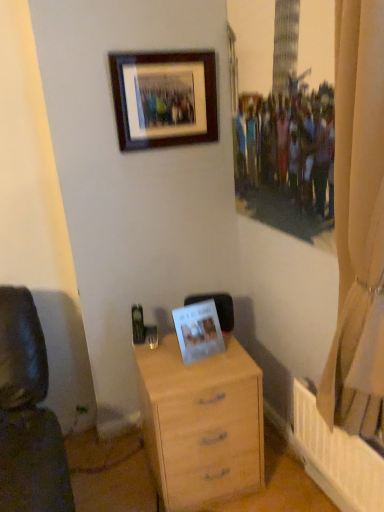
Question: Is light wood chest of drawers at center thinner than wooden frame at upper center, the first picture frame when ordered from top to bottom?

Choices:
 (A) yes
 (B) no

Answer: (B)

Question: From the image's perspective, is light wood chest of drawers at center on top of wooden frame at upper center, arranged as the second picture frame when ordered from the bottom?

Choices:
 (A) no
 (B) yes

Answer: (A)

Question: Is light wood chest of drawers at center oriented away from wooden frame at upper center, arranged as the second picture frame when ordered from the bottom?

Choices:
 (A) yes
 (B) no

Answer: (B)

Question: Is light wood chest of drawers at center next to wooden frame at upper center, the first picture frame when ordered from top to bottom?

Choices:
 (A) yes
 (B) no

Answer: (B)

Question: Is the position of light wood chest of drawers at center less distant than that of wooden frame at upper center, the first picture frame when ordered from top to bottom?

Choices:
 (A) no
 (B) yes

Answer: (B)

Question: Choose the correct answer: Is light wood chest of drawers at center inside white paper photo frame at center, acting as the 1th picture frame starting from the bottom, or outside it?

Choices:
 (A) inside
 (B) outside

Answer: (B)

Question: From a real-world perspective, is light wood chest of drawers at center positioned above or below white paper photo frame at center, acting as the 1th picture frame starting from the bottom?

Choices:
 (A) below
 (B) above

Answer: (A)

Question: From the image's perspective, relative to white paper photo frame at center, marked as the second picture frame in a top-to-bottom arrangement, is light wood chest of drawers at center above or below?

Choices:
 (A) above
 (B) below

Answer: (B)

Question: Considering the positions of light wood chest of drawers at center and white paper photo frame at center, acting as the 1th picture frame starting from the bottom, in the image, is light wood chest of drawers at center wider or thinner than white paper photo frame at center, acting as the 1th picture frame starting from the bottom,?

Choices:
 (A) wide
 (B) thin

Answer: (A)

Question: Is wooden frame at upper center, the first picture frame when ordered from top to bottom, in front of or behind beige fabric curtain at right in the image?

Choices:
 (A) front
 (B) behind

Answer: (B)

Question: From a real-world perspective, relative to beige fabric curtain at right, is wooden frame at upper center, arranged as the second picture frame when ordered from the bottom, vertically above or below?

Choices:
 (A) below
 (B) above

Answer: (B)

Question: From the image's perspective, is wooden frame at upper center, the first picture frame when ordered from top to bottom, above or below beige fabric curtain at right?

Choices:
 (A) above
 (B) below

Answer: (A)

Question: In terms of height, does wooden frame at upper center, the first picture frame when ordered from top to bottom, look taller or shorter compared to beige fabric curtain at right?

Choices:
 (A) short
 (B) tall

Answer: (A)

Question: Is beige fabric curtain at right in front of or behind white paper photo frame at center, acting as the 1th picture frame starting from the bottom, in the image?

Choices:
 (A) front
 (B) behind

Answer: (A)

Question: From the image's perspective, is beige fabric curtain at right positioned above or below white paper photo frame at center, acting as the 1th picture frame starting from the bottom?

Choices:
 (A) below
 (B) above

Answer: (B)